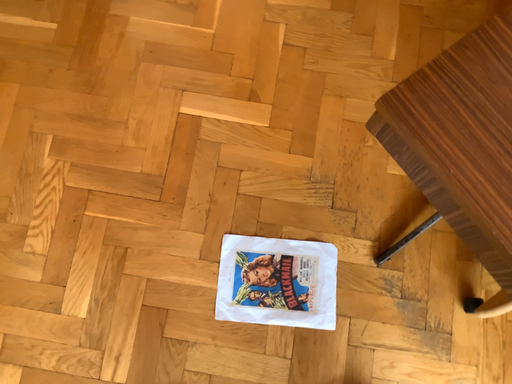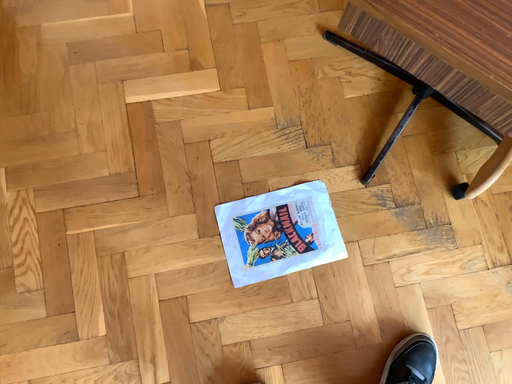
Question: How did the camera likely rotate when shooting the video?

Choices:
 (A) rotated left
 (B) rotated right

Answer: (B)